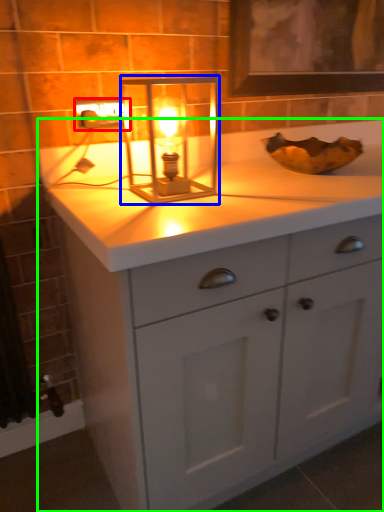
Question: Which object is positioned farthest from electric outlet (highlighted by a red box)? Select from candle holder (highlighted by a blue box) and bathroom cabinet (highlighted by a green box).

Choices:
 (A) candle holder
 (B) bathroom cabinet

Answer: (B)